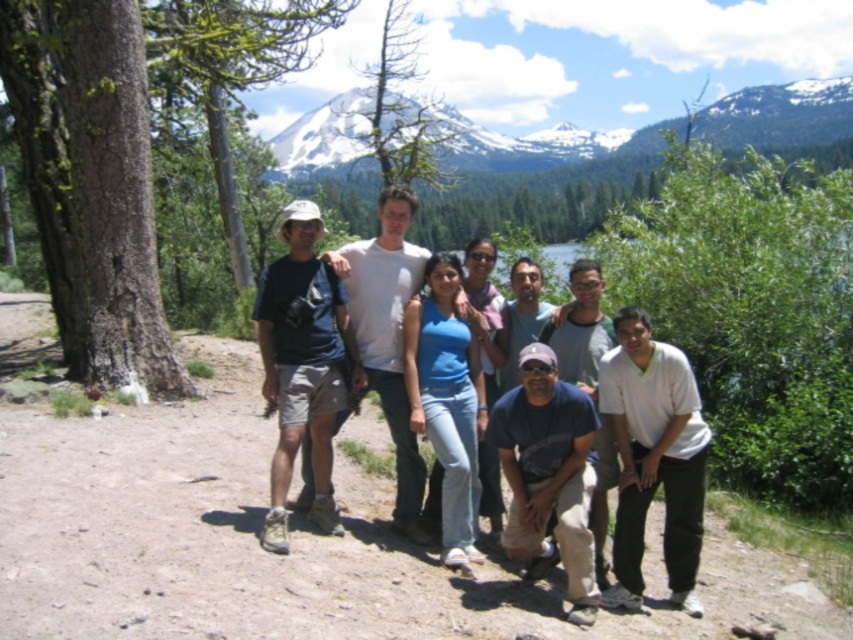
You are standing at the point labeled point (450, 499) and want to walk to the point labeled point (326, 307). Which direction should you move in relation to the camera?

You should move away from the camera because point (326, 307) is farther from the viewer than point (450, 499).

You are a photographer trying to capture a group photo of the scene. You need to ensure that the white cotton shirt at lower right and the blue denim jeans at center are both visible in the frame. Given their relative widths, which object might require more careful framing to ensure it doesn not get cut off?

The white cotton shirt at lower right has a lesser width compared to blue denim jeans at center, so the blue denim jeans at center may require more careful framing to ensure it does not get cut off due to its larger width.

You are a photographer trying to capture a group photo of the matte blue shirt at center and the white cotton shirt at lower right. Which of the two should you focus on first if you want to ensure both are in focus, considering their sizes?

The matte blue shirt at center is larger in size than the white cotton shirt at lower right, so focusing on the matte blue shirt at center first would ensure both are in focus since it is the larger subject.